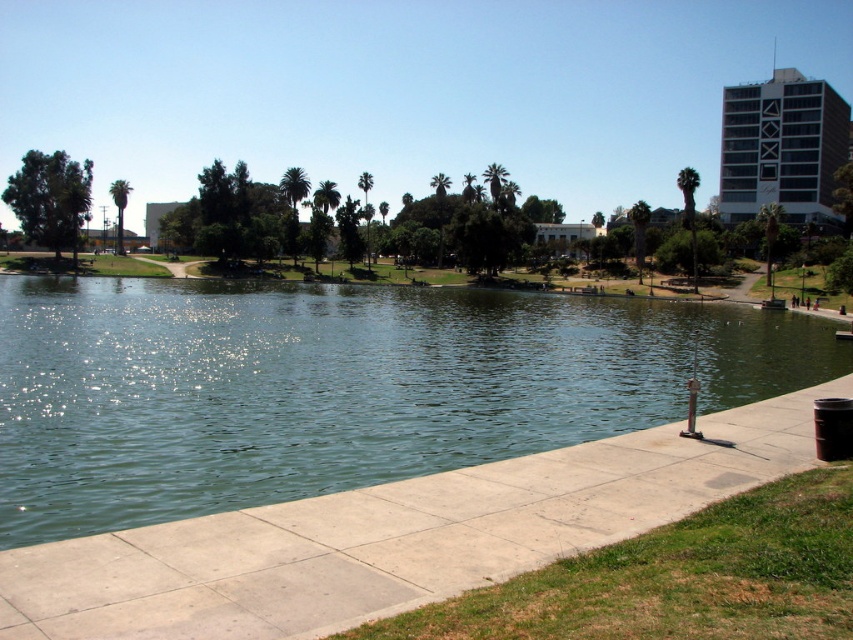
Describe the element at coordinates (337, 387) in the screenshot. I see `green concrete lake at center` at that location.

Can you confirm if green concrete lake at center is bigger than smooth concrete pavement at lower center?

Yes, green concrete lake at center is bigger than smooth concrete pavement at lower center.

Which is in front, point (306, 385) or point (302, 577)?

Positioned in front is point (302, 577).

Where is `green concrete lake at center`? The image size is (853, 640). green concrete lake at center is located at coordinates (337, 387).